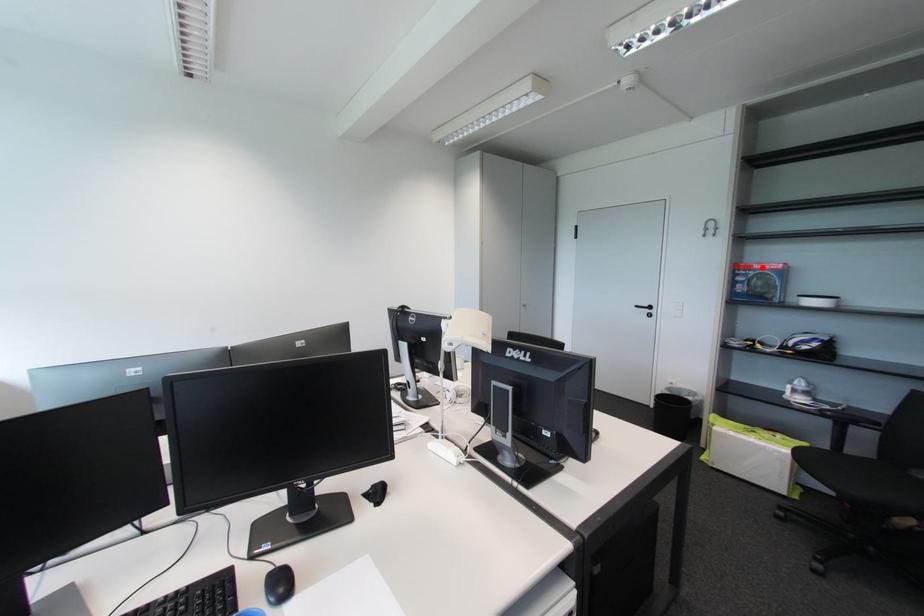
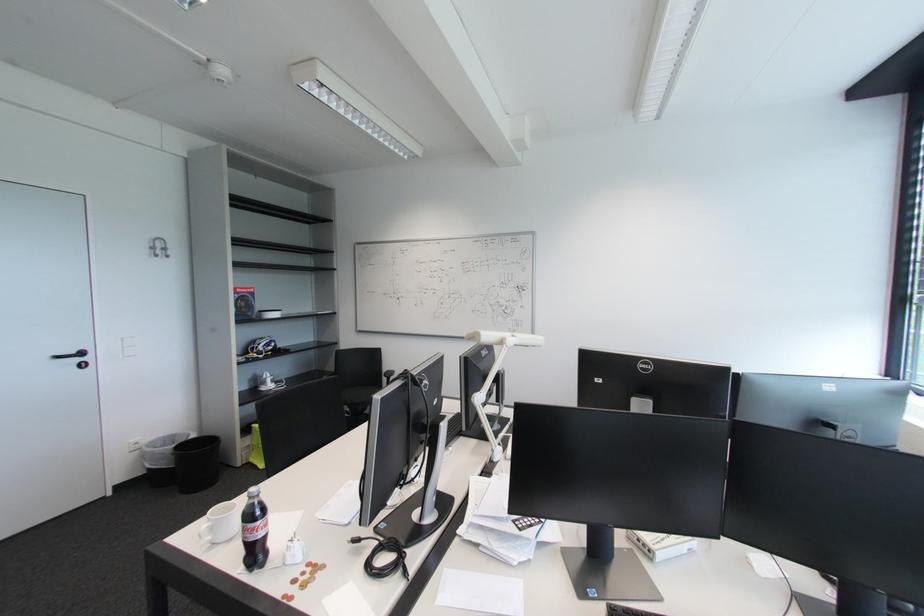
Locate, in the second image, the point that corresponds to the highlighted location in the first image.

(246, 292)